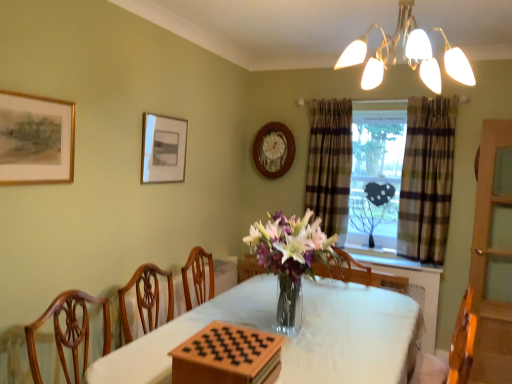
Locate an element on the screen. This screenshot has height=384, width=512. free spot below translucent glass vase at center (from a real-world perspective) is located at coordinates (307, 331).